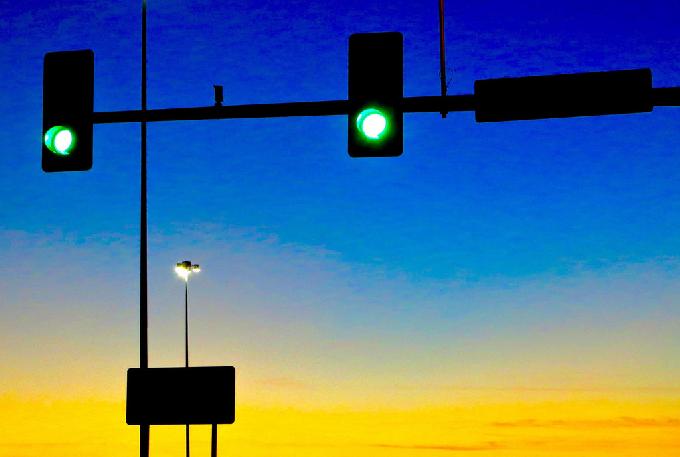
Image resolution: width=680 pixels, height=457 pixels. In order to click on green light in this screenshot , I will do `click(66, 134)`, `click(381, 116)`.